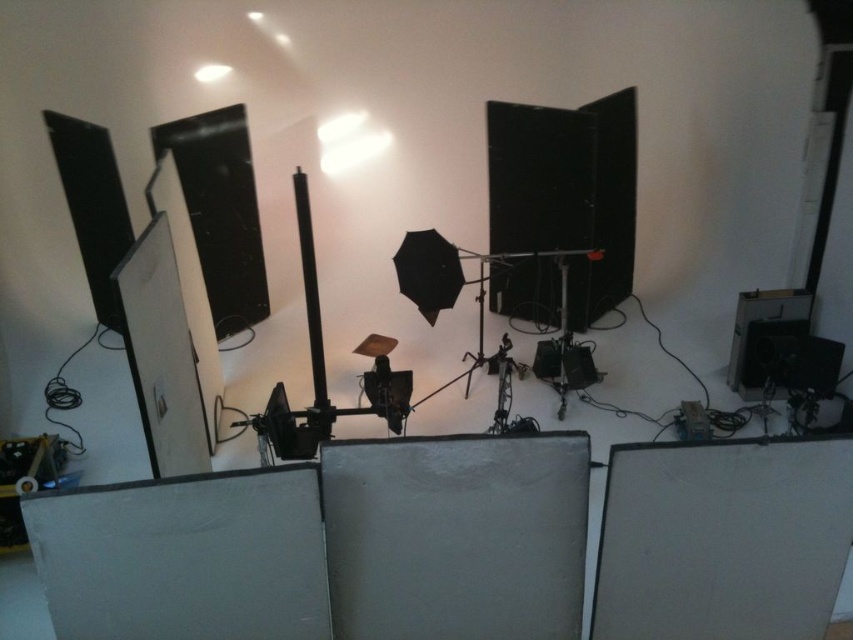
You are setting up a studio for a photoshoot and need to place the matte black speaker at upper left and the black plastic speaker at lower right. Based on their sizes, which speaker should you place on a higher shelf to avoid blocking the camera lens?

The matte black speaker at upper left is much taller than the black plastic speaker at lower right, so you should place the matte black speaker at upper left on a higher shelf to prevent it from blocking the camera lens.

You are setting up a sound system in the studio and need to place two speakers. You have a matte black speaker at upper left and a black plastic speaker at lower right. Which speaker is closer to you when facing the studio setup?

The matte black speaker at upper left is closer to you because it is further to the viewer than the black plastic speaker at lower right.

You are setting up a new microphone stand in the studio. The microphone stand has a base that requires a 1.5 meter distance from the matte black speaker at upper left to avoid interference. Where should you place the microphone stand?

The matte black speaker at upper left is located at coordinates approximately 0.323 on the x and 0.110 on the y axis. To ensure the microphone stand is at least 1.5 meters away, place it far from the speaker, maintaining the required distance based on the studio layout.